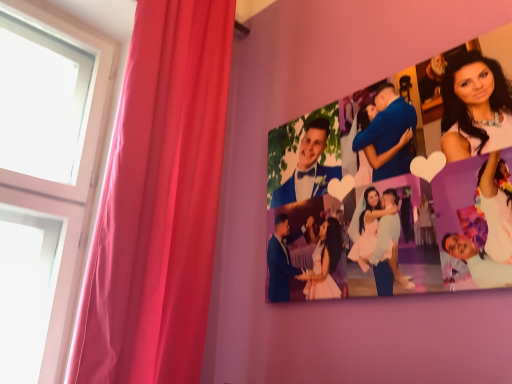
This screenshot has height=384, width=512. What do you see at coordinates (159, 201) in the screenshot? I see `matte pink curtain at left` at bounding box center [159, 201].

The image size is (512, 384). In order to click on matte pink curtain at left in this screenshot , I will do `click(159, 201)`.

In order to face matte pink curtain at left, should I rotate leftwards or rightwards?

To align with it, rotate left about 9.361°.

This screenshot has height=384, width=512. I want to click on matte pink curtain at left, so click(x=159, y=201).